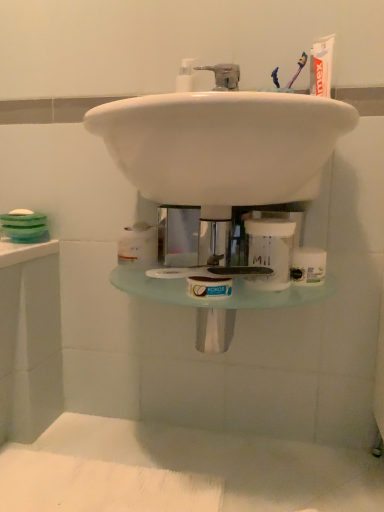
Question: Is white glossy sink at center touching white matte jar at center?

Choices:
 (A) no
 (B) yes

Answer: (A)

Question: From the image's perspective, does white glossy sink at center appear lower than white matte jar at center?

Choices:
 (A) yes
 (B) no

Answer: (B)

Question: Is white glossy sink at center at the left side of white matte jar at center?

Choices:
 (A) yes
 (B) no

Answer: (A)

Question: Would you say white glossy sink at center contains white matte jar at center?

Choices:
 (A) no
 (B) yes

Answer: (A)

Question: Is white glossy sink at center smaller than white matte jar at center?

Choices:
 (A) no
 (B) yes

Answer: (A)

Question: Is white glossy sink at center facing away from white matte jar at center?

Choices:
 (A) yes
 (B) no

Answer: (B)

Question: Considering the relative positions of white matte jar at center and white glossy sink at center in the image provided, is white matte jar at center behind white glossy sink at center?

Choices:
 (A) yes
 (B) no

Answer: (A)

Question: Is white matte jar at center in front of white glossy sink at center?

Choices:
 (A) yes
 (B) no

Answer: (B)

Question: Is white matte jar at center placed right next to white glossy sink at center?

Choices:
 (A) yes
 (B) no

Answer: (B)

Question: Can you confirm if white matte jar at center is bigger than white glossy sink at center?

Choices:
 (A) yes
 (B) no

Answer: (B)

Question: Considering the relative sizes of white matte jar at center and white glossy sink at center in the image provided, is white matte jar at center smaller than white glossy sink at center?

Choices:
 (A) yes
 (B) no

Answer: (A)

Question: Is white matte jar at center taller than white glossy sink at center?

Choices:
 (A) yes
 (B) no

Answer: (B)

Question: In the image, is white glossy sink at center on the left side or the right side of white matte jar at center?

Choices:
 (A) right
 (B) left

Answer: (B)